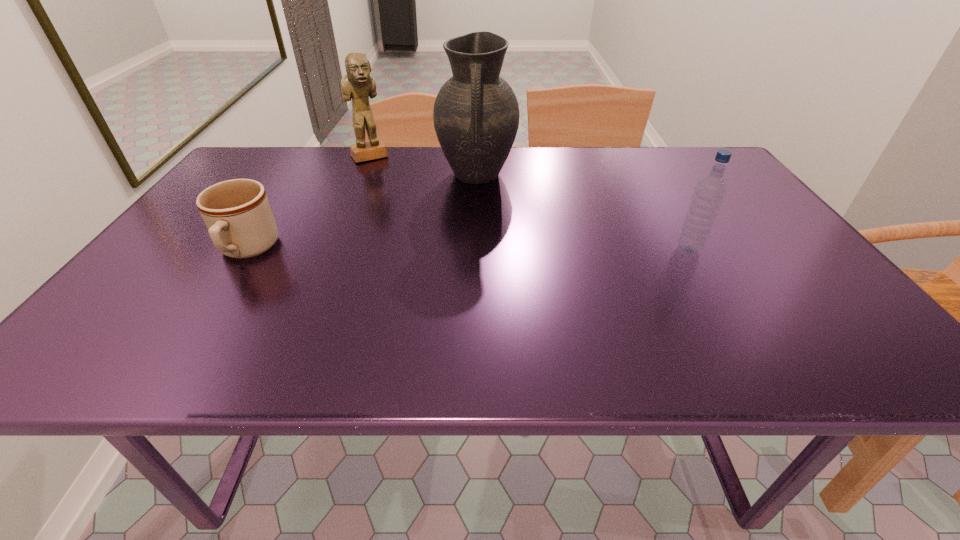
Where is `the shortest object`? This screenshot has height=540, width=960. the shortest object is located at coordinates (237, 213).

You are a GUI agent. You are given a task and a screenshot of the screen. Output one action in this format:
    pyautogui.click(x=<x>, y=<y>)
    Task: Click on the mug
    
    Given the screenshot: What is the action you would take?
    pyautogui.click(x=237, y=213)

Locate an element on the screen. water bottle is located at coordinates (709, 192).

Where is `the rightmost object`? Image resolution: width=960 pixels, height=540 pixels. the rightmost object is located at coordinates (709, 192).

Where is `pitcher`? The height and width of the screenshot is (540, 960). pitcher is located at coordinates (476, 114).

This screenshot has height=540, width=960. In order to click on the second object from right to left in this screenshot , I will do `click(476, 114)`.

Find the location of a particular element. the second object from left to right is located at coordinates (358, 84).

I want to click on the second tallest object, so click(358, 84).

Locate an element on the screen. This screenshot has height=540, width=960. free space located 0.130m on the side of the leftmost object with the handle is located at coordinates (202, 320).

The image size is (960, 540). I want to click on vacant space located on the back of the water bottle, so click(x=640, y=168).